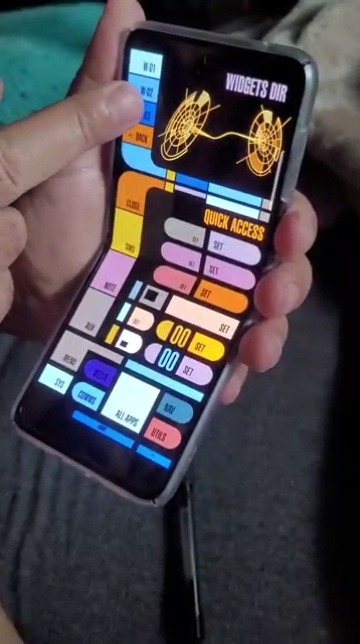
The image size is (360, 644). What are the coordinates of `pen` in the screenshot? It's located at (188, 535).